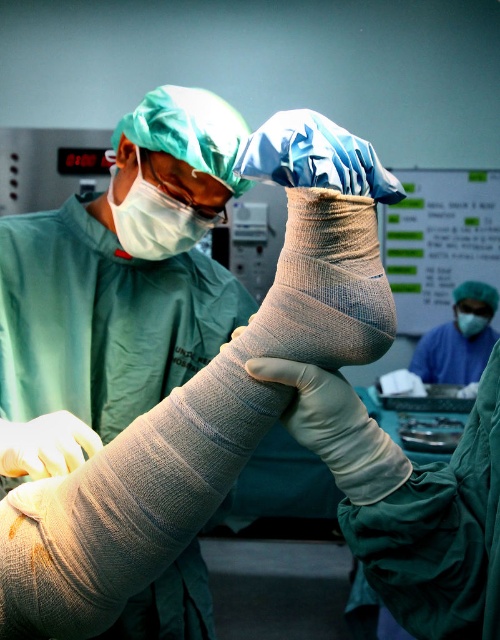
Measure the distance from white matte mask at upper left to smooth beige skin at lower left.

white matte mask at upper left and smooth beige skin at lower left are 45.22 centimeters apart from each other.

Who is positioned more to the right, white matte mask at upper left or smooth beige skin at lower left?

Positioned to the right is white matte mask at upper left.

Which is behind, point (157, 230) or point (10, 464)?

Point (157, 230)

Find the location of a particular element. The height and width of the screenshot is (640, 500). white matte mask at upper left is located at coordinates (156, 220).

Who is shorter, gray bandaged arm at center or white matte mask at upper left?

white matte mask at upper left

Can you confirm if gray bandaged arm at center is shorter than white matte mask at upper left?

In fact, gray bandaged arm at center may be taller than white matte mask at upper left.

Locate an element on the screen. This screenshot has width=500, height=640. gray bandaged arm at center is located at coordinates (410, 502).

Does white matte mask at upper left appear over matte white mask at center?

Yes.

Does white matte mask at upper left have a lesser height compared to matte white mask at center?

Yes, white matte mask at upper left is shorter than matte white mask at center.

Is point (129, 192) positioned behind point (473, 304)?

No, (129, 192) is closer to viewer.

At what (x,y) coordinates should I click in order to perform the action: click on white matte mask at upper left. Please return your answer as a coordinate pair (x, y). Looking at the image, I should click on (156, 220).